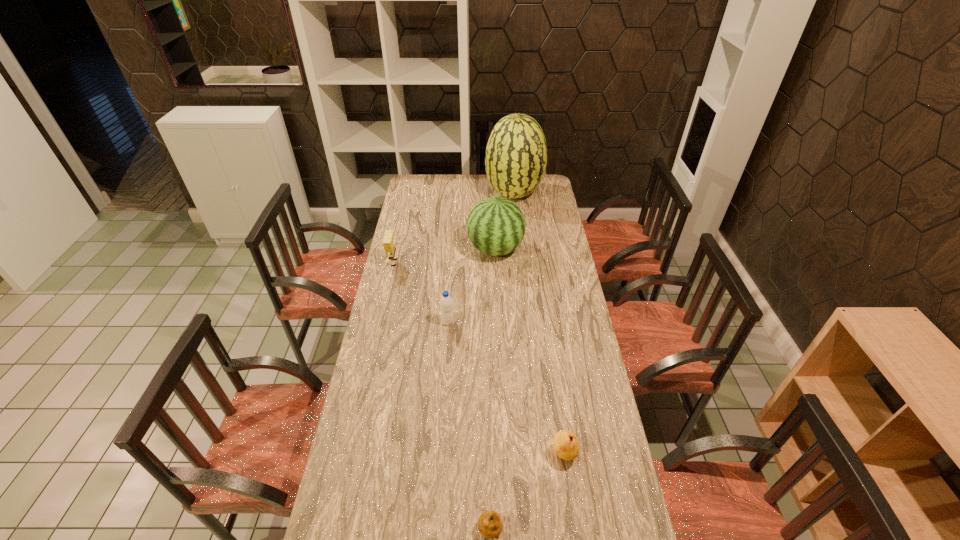
Where is `the farther watermelon`? the farther watermelon is located at coordinates (516, 155).

Find the location of `the farthest object`. the farthest object is located at coordinates (516, 155).

Find the location of a particular element. Image resolution: width=960 pixels, height=540 pixels. the nearer watermelon is located at coordinates (496, 226).

This screenshot has width=960, height=540. I want to click on the shorter watermelon, so click(x=496, y=226).

You are a GUI agent. You are given a task and a screenshot of the screen. Output one action in this format:
    pyautogui.click(x=<x>, y=<y>)
    Task: Click on the water bottle
    
    Given the screenshot: What is the action you would take?
    pyautogui.click(x=446, y=304)

At what (x,y) coordinates should I click in order to perform the action: click on the third nearest object. Please return your answer as a coordinate pair (x, y). Looking at the image, I should click on (446, 304).

At what (x,y) coordinates should I click in order to perform the action: click on the leftmost object. Please return your answer as a coordinate pair (x, y). Image resolution: width=960 pixels, height=540 pixels. Looking at the image, I should click on point(389,242).

Image resolution: width=960 pixels, height=540 pixels. Identify the location of the taller pear. (565, 443).

This screenshot has height=540, width=960. I want to click on the right pear, so click(565, 443).

The width and height of the screenshot is (960, 540). I want to click on vacant region located on the left of the tallest object, so click(449, 194).